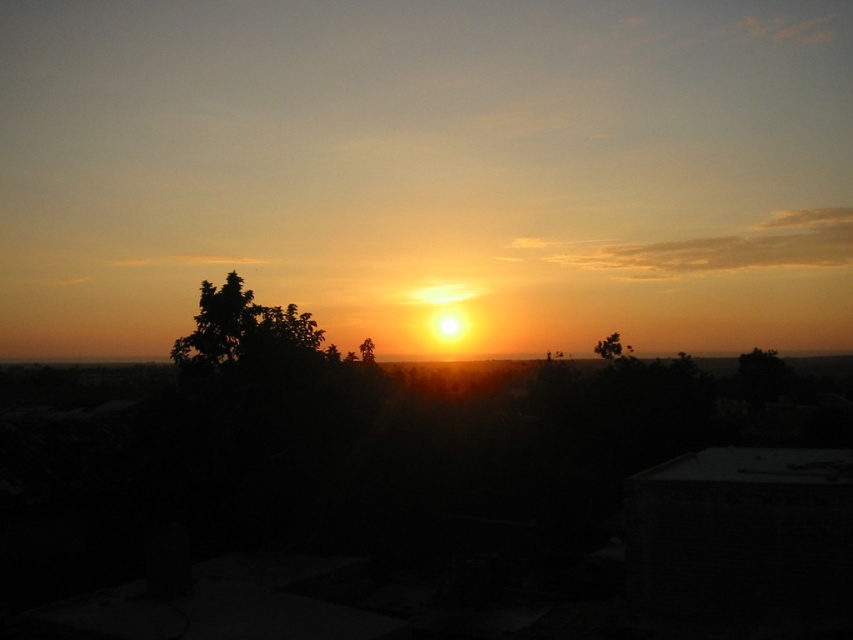
Question: Which of the following is the farthest from the observer?

Choices:
 (A) green leafy tree at center
 (B) green leafy tree at upper right

Answer: (B)

Question: Can you confirm if green leafy tree at upper right is positioned to the right of green leafy tree at center?

Choices:
 (A) no
 (B) yes

Answer: (B)

Question: Can you confirm if green leafy tree at upper right is positioned to the right of green leafy tree at center?

Choices:
 (A) no
 (B) yes

Answer: (B)

Question: Is green leafy tree at upper right to the left of green leafy tree at center from the viewer's perspective?

Choices:
 (A) no
 (B) yes

Answer: (A)